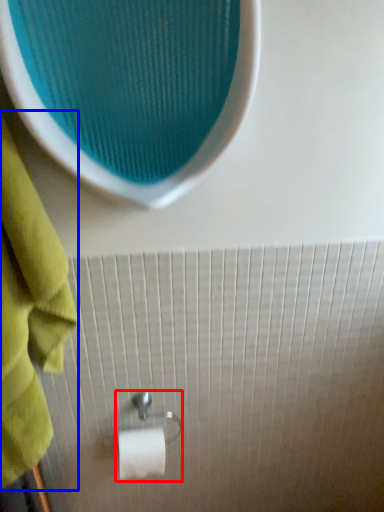
Question: Which point is closer to the camera, towel bar (highlighted by a red box) or towel (highlighted by a blue box)?

Choices:
 (A) towel bar
 (B) towel

Answer: (B)